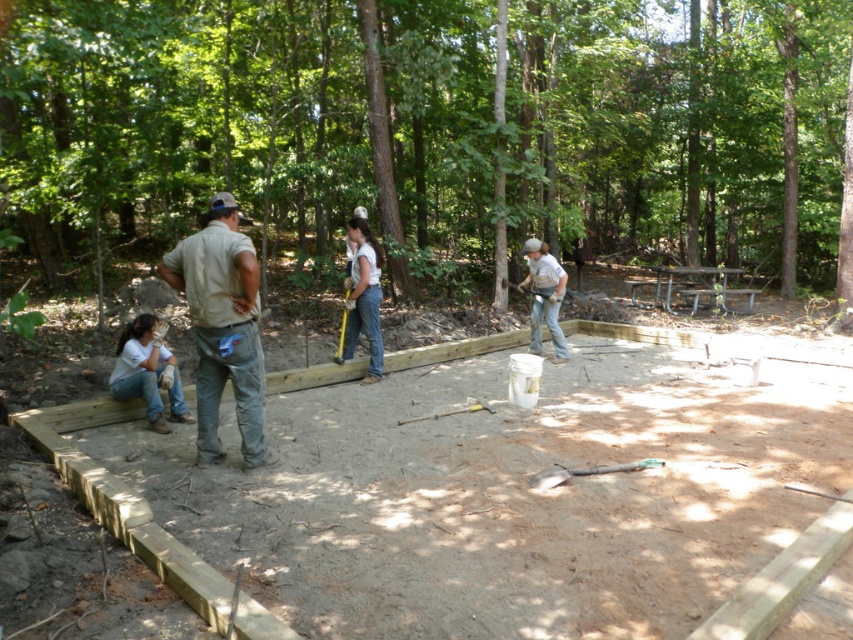
Who is taller, light brown wood at center or matte gray shirt at center?

With more height is light brown wood at center.

Who is higher up, light brown wood at center or matte gray shirt at center?

matte gray shirt at center is higher up.

Between point (45, 428) and point (544, 316), which one is positioned in front?

Point (45, 428) is in front.

Locate an element on the screen. light brown wood at center is located at coordinates (128, 513).

Can you confirm if tan canvas shirt at center is smaller than white cotton shirt at lower left?

No, tan canvas shirt at center is not smaller than white cotton shirt at lower left.

Who is shorter, tan canvas shirt at center or white cotton shirt at lower left?

With less height is white cotton shirt at lower left.

Is point (234, 259) positioned in front of point (148, 358)?

Yes, point (234, 259) is closer to viewer.

This screenshot has width=853, height=640. Identify the location of tan canvas shirt at center. (222, 326).

Is point (170, 388) more distant than point (531, 342)?

No.

Between point (108, 381) and point (532, 332), which one is positioned in front?

Point (108, 381) is in front.

Where is `white cotton shirt at lower left`? The height and width of the screenshot is (640, 853). white cotton shirt at lower left is located at coordinates (148, 372).